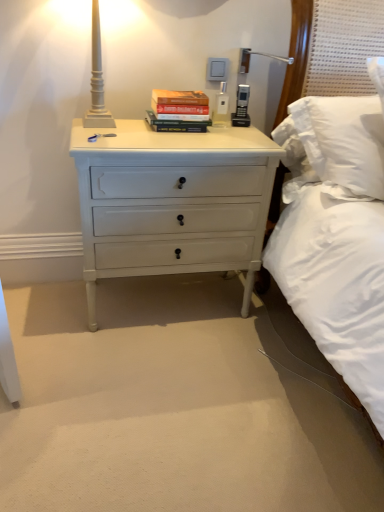
Where is `vacant space in front of hardcover book at center`? The image size is (384, 512). vacant space in front of hardcover book at center is located at coordinates (172, 136).